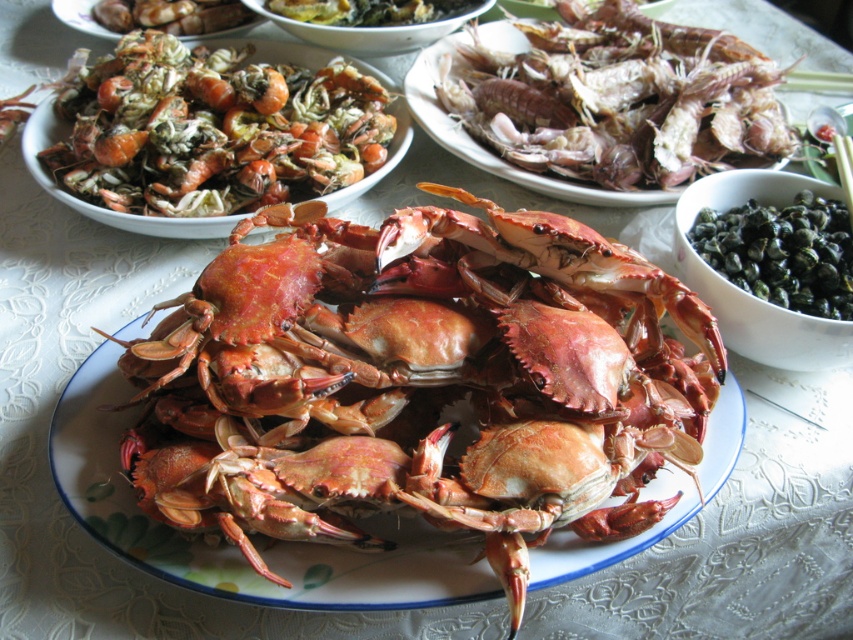
Who is more distant from viewer, (653,182) or (373,44)?

Positioned behind is point (373,44).

Is point (762, 108) positioned after point (489, 4)?

That is False.

Locate an element on the screen. The image size is (853, 640). brown matte crab at center is located at coordinates (619, 99).

Locate an element on the screen. brown matte crab at center is located at coordinates coord(619,99).

Can you confirm if shiny brown crab at center is positioned to the right of matte brown shells at upper left?

Indeed, shiny brown crab at center is positioned on the right side of matte brown shells at upper left.

Is shiny brown crab at center above matte brown shells at upper left?

No, shiny brown crab at center is not above matte brown shells at upper left.

At what (x,y) coordinates should I click in order to perform the action: click on shiny brown crab at center. Please return your answer as a coordinate pair (x, y). The image size is (853, 640). Looking at the image, I should click on (427, 378).

Locate an element on the screen. The image size is (853, 640). shiny brown crab at center is located at coordinates (427, 378).

Between brown matte crab at center and matte brown shells at upper left, which one appears on the right side from the viewer's perspective?

brown matte crab at center is more to the right.

Which is above, brown matte crab at center or matte brown shells at upper left?

Positioned higher is matte brown shells at upper left.

Is point (764, 88) behind point (73, 12)?

That is False.

Locate an element on the screen. The width and height of the screenshot is (853, 640). brown matte crab at center is located at coordinates (619, 99).